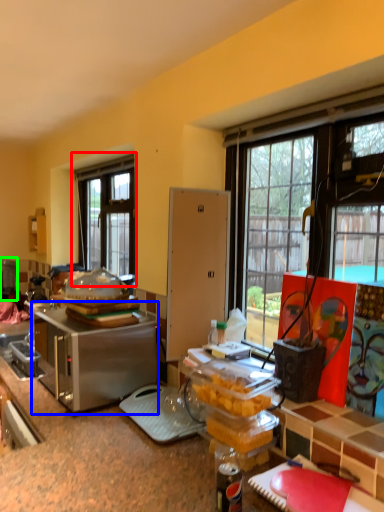
Question: Which is farther away from window (highlighted by a red box)? appliance (highlighted by a blue box) or appliance (highlighted by a green box)?

Choices:
 (A) appliance
 (B) appliance

Answer: (A)